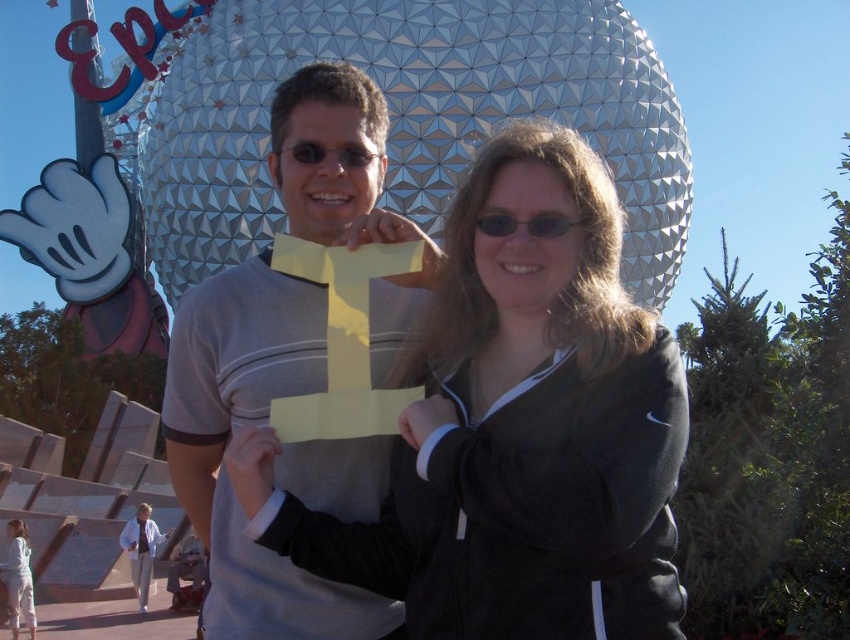
Question: Estimate the real-world distances between objects in this image. Which object is farther from the matte black sunglasses at center?

Choices:
 (A) black matte jacket at center
 (B) gray matte t-shirt at center
 (C) black plastic sunglasses at center

Answer: (A)

Question: Among these objects, which one is farthest from the camera?

Choices:
 (A) black matte jacket at center
 (B) matte black sunglasses at center

Answer: (B)

Question: In this image, where is black matte jacket at center located relative to black plastic sunglasses at center?

Choices:
 (A) left
 (B) right

Answer: (B)

Question: Which object is positioned farthest from the black matte jacket at center?

Choices:
 (A) matte black sunglasses at center
 (B) black plastic sunglasses at center

Answer: (A)

Question: Does black matte jacket at center have a greater width compared to matte black sunglasses at center?

Choices:
 (A) no
 (B) yes

Answer: (B)

Question: Is black matte jacket at center smaller than matte black sunglasses at center?

Choices:
 (A) no
 (B) yes

Answer: (A)